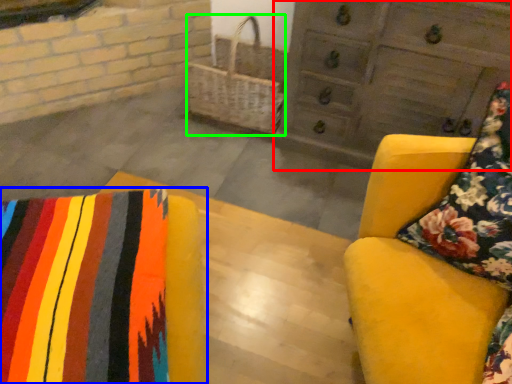
Question: Which is nearer to the chest of drawers (highlighted by a red box)? furniture (highlighted by a blue box) or basket (highlighted by a green box).

Choices:
 (A) furniture
 (B) basket

Answer: (B)